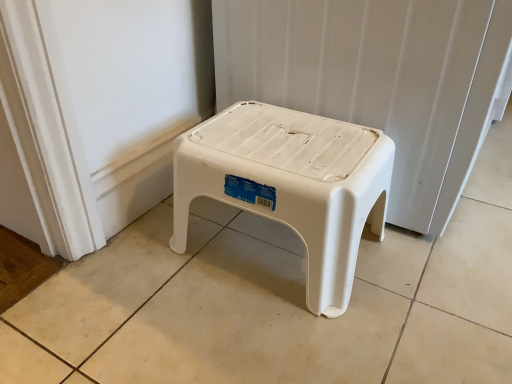
Find the location of a particular element. The width and height of the screenshot is (512, 384). vacant space situated on the left part of white plastic stool at center is located at coordinates (135, 280).